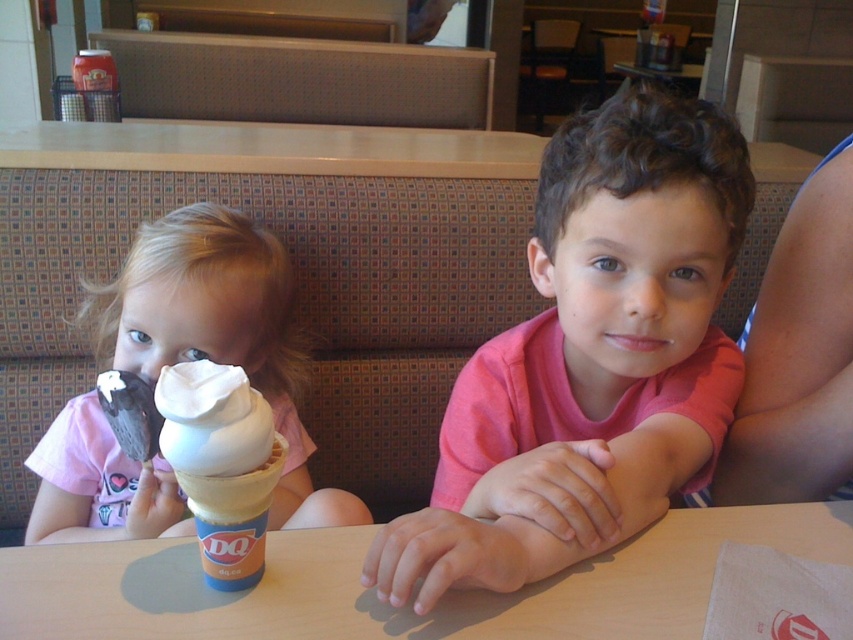
Question: Does pink matte shirt at center have a smaller size compared to smooth wooden table at center?

Choices:
 (A) no
 (B) yes

Answer: (A)

Question: Which point appears farthest from the camera in this image?

Choices:
 (A) (173, 440)
 (B) (24, 552)
 (C) (91, 452)
 (D) (401, 602)

Answer: (C)

Question: Based on their relative distances, which object is nearer to the white soft serve ice cream at center?

Choices:
 (A) matte white ice cream cone at left
 (B) smooth wooden table at center

Answer: (B)

Question: Which point is farther from the camera taking this photo?

Choices:
 (A) (103, 496)
 (B) (51, 596)

Answer: (A)

Question: Is smooth wooden table at center further to camera compared to matte white ice cream cone at left?

Choices:
 (A) yes
 (B) no

Answer: (B)

Question: Does smooth wooden table at center come in front of white soft serve ice cream at center?

Choices:
 (A) yes
 (B) no

Answer: (B)